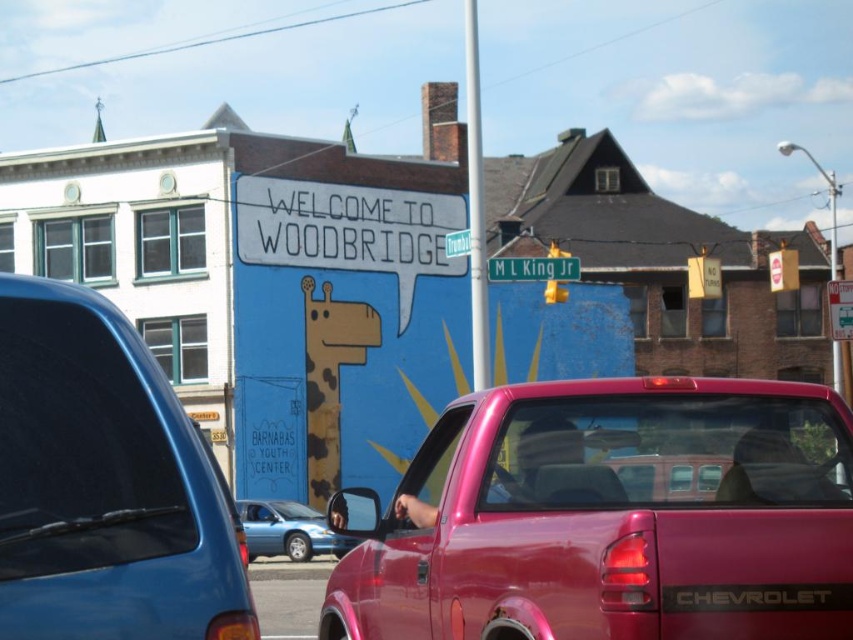
You are standing at the entrance of the Barnabas Youth Center and want to park your car. You see a metallic pink truck at center. Is the truck parked in a valid parking spot?

The metallic pink truck at center is parked at coordinates point (608, 516). Without specific parking zone information, it is impossible to determine if this location is a valid parking spot.

You are a delivery person who needs to park your 2.5 meters tall truck in this street scene. The parking spot is between the metallic pink truck at center and the metallic blue sedan at center. Can your truck fit in the available space between them?

The metallic pink truck at center is much taller than the metallic blue sedan at center. Since your truck is 2.5 meters tall, you need to ensure there is enough vertical clearance. However, the description only mentions their relative heights, not the actual height of the metallic pink truck. Without knowing the exact height of the existing trucks, it is impossible to determine if your truck can fit.

You are a delivery driver who needs to park your vehicle between two other cars on the street. You have a metallic pink truck at center and a metallic blue sedan at center. Which vehicle should you choose to ensure you can fit into a parking spot that is only 5 feet wide?

The metallic pink truck at center has a lesser width compared to the metallic blue sedan at center, so you should choose the metallic pink truck at center to fit into the 5 feet wide parking spot.